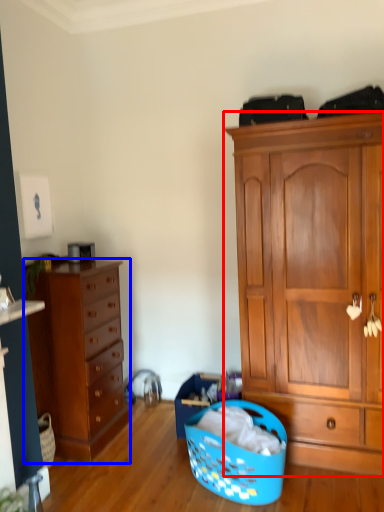
Question: Which object appears farthest to the camera in this image, cabinetry (highlighted by a red box) or chest of drawers (highlighted by a blue box)?

Choices:
 (A) cabinetry
 (B) chest of drawers

Answer: (B)